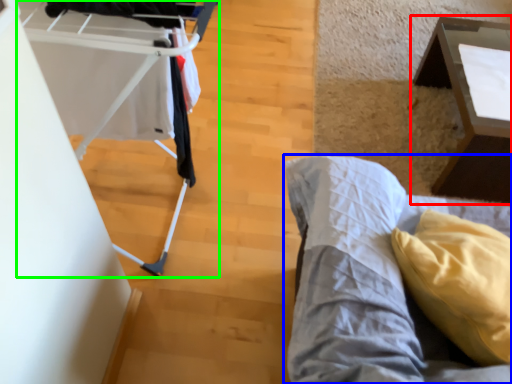
Question: Which is farther away from table (highlighted by a red box)? furniture (highlighted by a blue box) or baby carriage (highlighted by a green box)?

Choices:
 (A) furniture
 (B) baby carriage

Answer: (B)